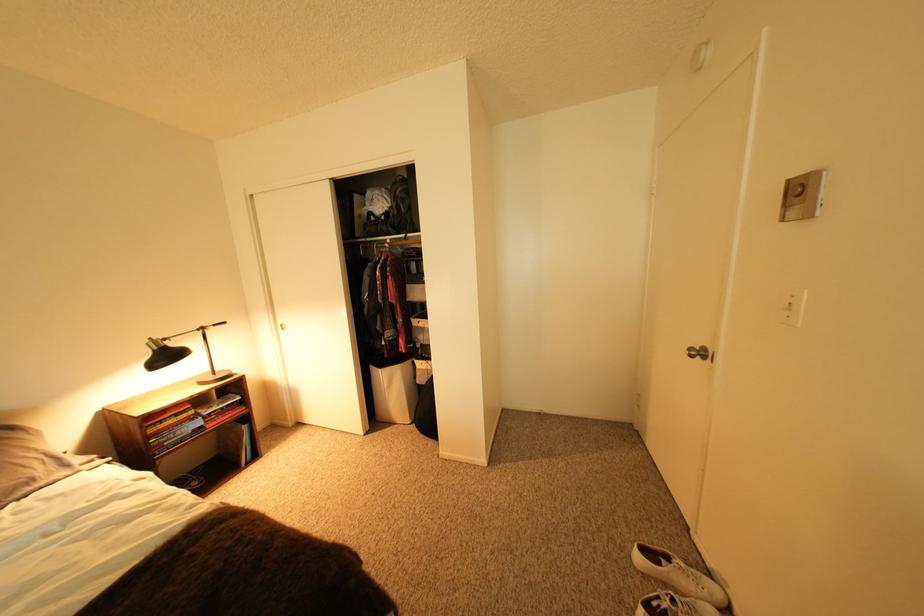
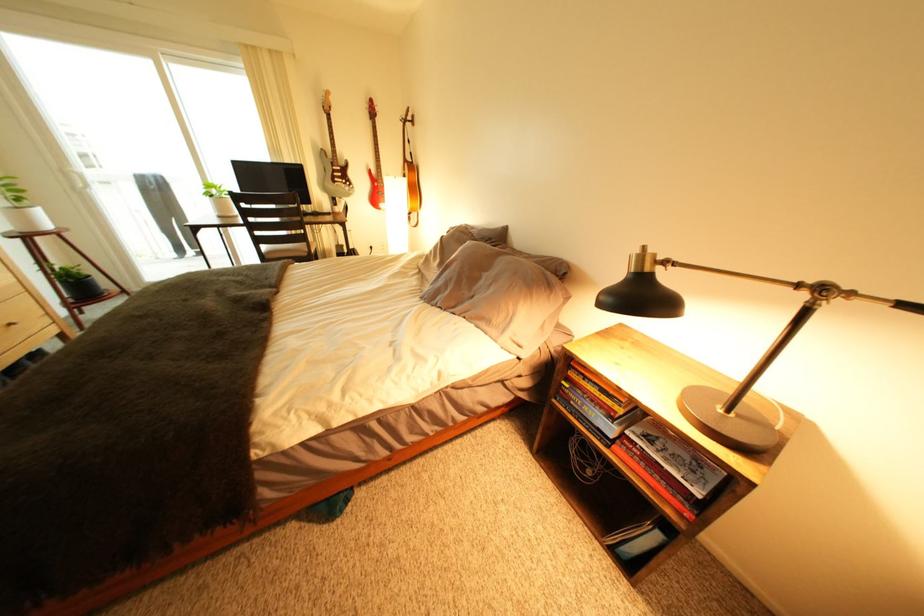
In the second image, find the point that corresponds to the point at 45,482 in the first image.

(503, 323)